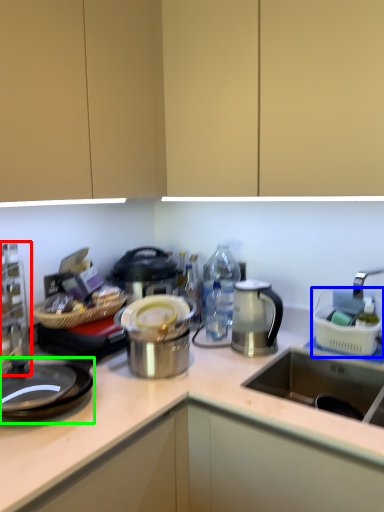
Question: Considering the real-world distances, which object is farthest from kitchen appliance (highlighted by a red box)? appliance (highlighted by a blue box) or gas stove (highlighted by a green box)?

Choices:
 (A) appliance
 (B) gas stove

Answer: (A)